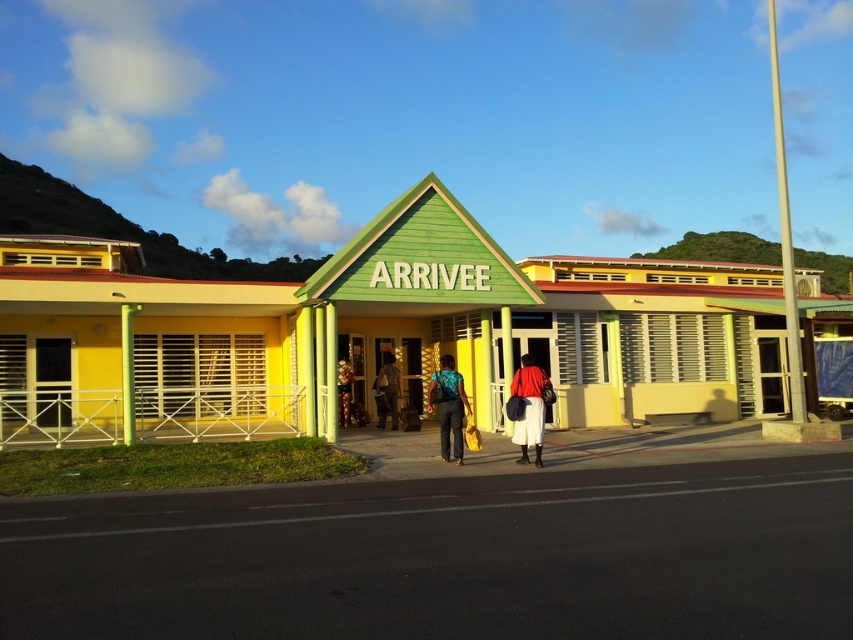
You are a delivery person who needs to place a package between the teal fabric backpack at center and the red matte skirt at center. Is there enough space to place the package without moving either item?

The distance between the teal fabric backpack at center and the red matte skirt at center is 3.38 feet, so there is sufficient space to place the package between them without moving either item.

You are a traveler standing at the entrance of the building and see both the teal fabric backpack at center and the red matte skirt at center. Which item is shorter in height?

The teal fabric backpack at center is not as tall as the red matte skirt at center, so the teal fabric backpack at center is shorter.